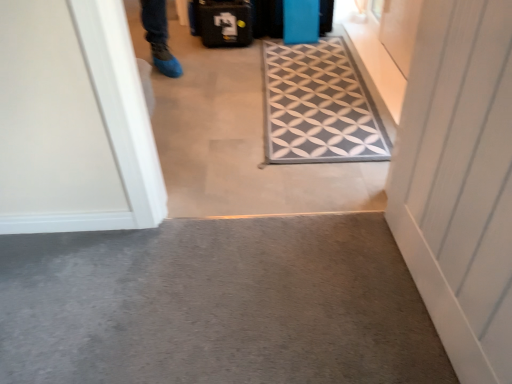
Question: Can you confirm if white wood door at right is smaller than carpeted floor at center?

Choices:
 (A) yes
 (B) no

Answer: (A)

Question: Is white wood door at right further to the viewer compared to carpeted floor at center?

Choices:
 (A) no
 (B) yes

Answer: (A)

Question: Is there a large distance between white wood door at right and carpeted floor at center?

Choices:
 (A) no
 (B) yes

Answer: (A)

Question: From the image's perspective, does white wood door at right appear lower than carpeted floor at center?

Choices:
 (A) yes
 (B) no

Answer: (A)

Question: Can you confirm if white wood door at right is positioned to the right of carpeted floor at center?

Choices:
 (A) yes
 (B) no

Answer: (A)

Question: From a real-world perspective, is black textured suitcase at upper center, which ranks as the 2th luggage in right-to-left order, physically located above or below gray carpet at lower center?

Choices:
 (A) below
 (B) above

Answer: (B)

Question: Is point (234, 34) positioned closer to the camera than point (79, 261)?

Choices:
 (A) closer
 (B) farther

Answer: (B)

Question: Looking at their shapes, would you say black textured suitcase at upper center, the 1th luggage viewed from the left, is wider or thinner than gray carpet at lower center?

Choices:
 (A) thin
 (B) wide

Answer: (A)

Question: In terms of size, does black textured suitcase at upper center, which ranks as the 2th luggage in right-to-left order, appear bigger or smaller than gray carpet at lower center?

Choices:
 (A) small
 (B) big

Answer: (A)

Question: Considering the positions of carpeted floor at center and white wood door at right in the image, is carpeted floor at center bigger or smaller than white wood door at right?

Choices:
 (A) small
 (B) big

Answer: (B)

Question: Considering the positions of point (266, 172) and point (467, 4), is point (266, 172) closer or farther from the camera than point (467, 4)?

Choices:
 (A) farther
 (B) closer

Answer: (A)

Question: In terms of height, does carpeted floor at center look taller or shorter compared to white wood door at right?

Choices:
 (A) short
 (B) tall

Answer: (A)

Question: From the image's perspective, relative to white wood door at right, is carpeted floor at center above or below?

Choices:
 (A) below
 (B) above

Answer: (B)

Question: In terms of size, does blue matte suitcase at upper center, the second luggage viewed from the left, appear bigger or smaller than carpeted floor at center?

Choices:
 (A) small
 (B) big

Answer: (A)

Question: From a real-world perspective, is blue matte suitcase at upper center, the second luggage viewed from the left, physically located above or below carpeted floor at center?

Choices:
 (A) below
 (B) above

Answer: (A)